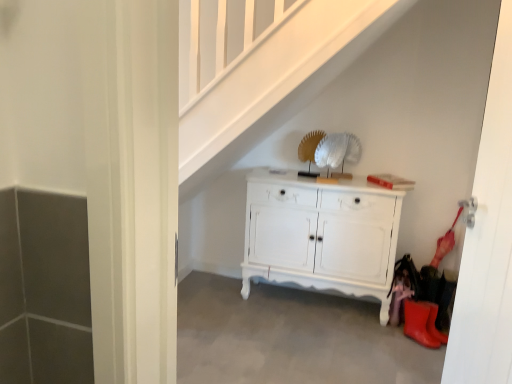
Question: From the image's perspective, is white glossy door at right over white painted wood cabinet at center?

Choices:
 (A) yes
 (B) no

Answer: (A)

Question: Does white glossy door at right have a greater height compared to white painted wood cabinet at center?

Choices:
 (A) yes
 (B) no

Answer: (A)

Question: Considering the relative sizes of white glossy door at right and white painted wood cabinet at center in the image provided, is white glossy door at right bigger than white painted wood cabinet at center?

Choices:
 (A) yes
 (B) no

Answer: (B)

Question: Is white glossy door at right surrounding white painted wood cabinet at center?

Choices:
 (A) no
 (B) yes

Answer: (A)

Question: Is white glossy door at right oriented towards white painted wood cabinet at center?

Choices:
 (A) yes
 (B) no

Answer: (B)

Question: Can you confirm if white glossy door at right is smaller than white painted wood cabinet at center?

Choices:
 (A) yes
 (B) no

Answer: (A)

Question: Is rubber/matte boot at lower right surrounded by white painted wood cabinet at center?

Choices:
 (A) yes
 (B) no

Answer: (B)

Question: Can you confirm if white painted wood cabinet at center is wider than rubber/matte boot at lower right?

Choices:
 (A) no
 (B) yes

Answer: (B)

Question: Is the depth of white painted wood cabinet at center greater than that of rubber/matte boot at lower right?

Choices:
 (A) yes
 (B) no

Answer: (A)

Question: Is white painted wood cabinet at center to the left of rubber/matte boot at lower right from the viewer's perspective?

Choices:
 (A) yes
 (B) no

Answer: (A)

Question: Is white painted wood cabinet at center next to rubber/matte boot at lower right and touching it?

Choices:
 (A) no
 (B) yes

Answer: (A)

Question: From the image's perspective, is white painted wood cabinet at center on top of rubber/matte boot at lower right?

Choices:
 (A) no
 (B) yes

Answer: (B)

Question: Considering the relative sizes of gray concrete at lower center and white painted wood cabinet at center in the image provided, is gray concrete at lower center bigger than white painted wood cabinet at center?

Choices:
 (A) yes
 (B) no

Answer: (B)